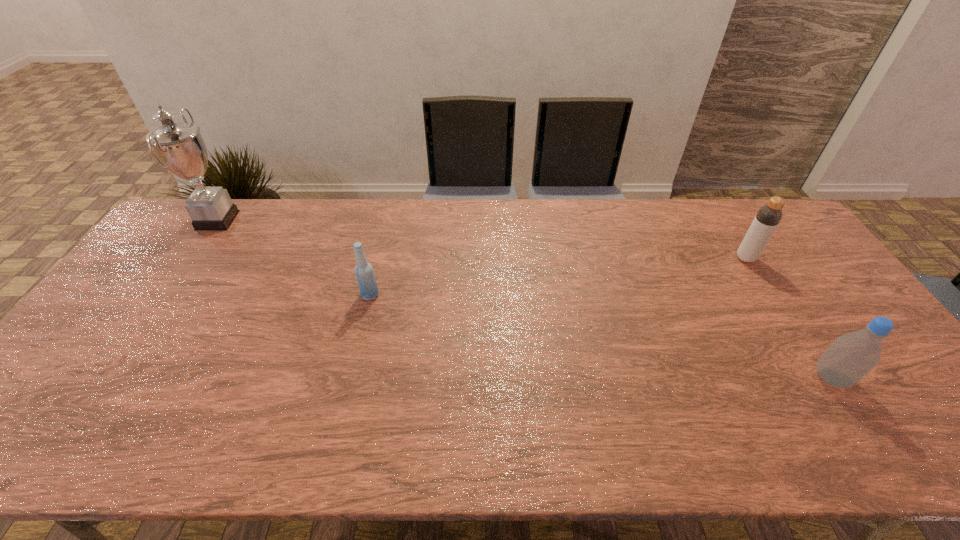
Locate an element on the screen. The image size is (960, 540). vacant space that satisfies the following two spatial constraints: 1. at the front view of the tallest object; 2. on the left side of the nearest object is located at coordinates pos(110,377).

Where is `vacant region that satisfies the following two spatial constraints: 1. on the back side of the farthest bottle; 2. at the front view of the trophy cup`? vacant region that satisfies the following two spatial constraints: 1. on the back side of the farthest bottle; 2. at the front view of the trophy cup is located at coordinates (722, 220).